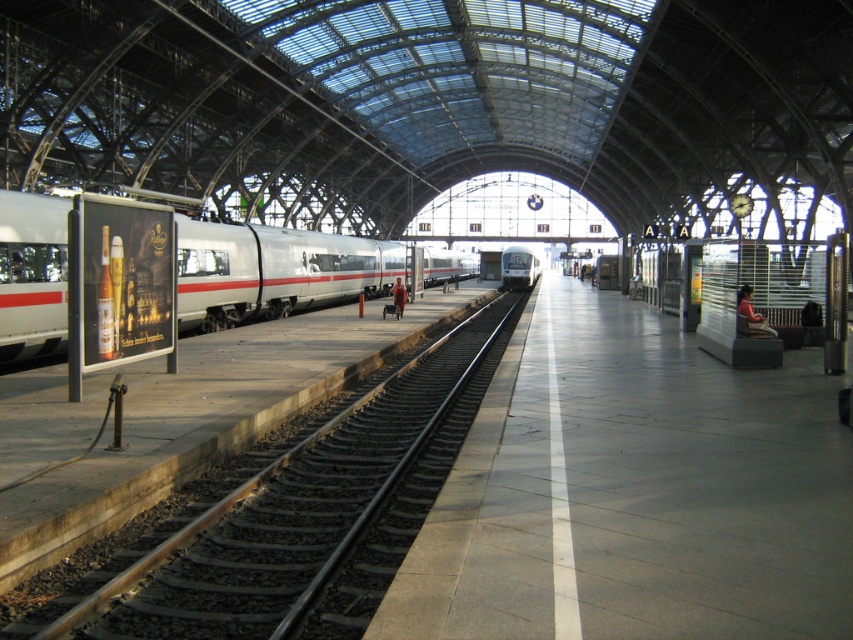
This screenshot has width=853, height=640. Describe the element at coordinates (283, 513) in the screenshot. I see `smooth steel train track at left` at that location.

Is point (427, 397) farther from camera compared to point (506, 269)?

No, (427, 397) is closer to viewer.

The image size is (853, 640). What are the coordinates of `smooth steel train track at left` in the screenshot? It's located at (283, 513).

Which is more to the right, silver metallic train at left or silver metallic train at center?

silver metallic train at center is more to the right.

Is point (27, 212) positioned before point (506, 284)?

Yes, point (27, 212) is in front of point (506, 284).

The height and width of the screenshot is (640, 853). In order to click on silver metallic train at left in this screenshot , I will do `click(273, 269)`.

Based on the photo, is smooth steel train track at left further to the viewer compared to silver metallic train at left?

No.

Is smooth steel train track at left above silver metallic train at left?

No, smooth steel train track at left is not above silver metallic train at left.

The image size is (853, 640). What do you see at coordinates (283, 513) in the screenshot?
I see `smooth steel train track at left` at bounding box center [283, 513].

The height and width of the screenshot is (640, 853). Find the location of `smooth steel train track at left`. smooth steel train track at left is located at coordinates (283, 513).